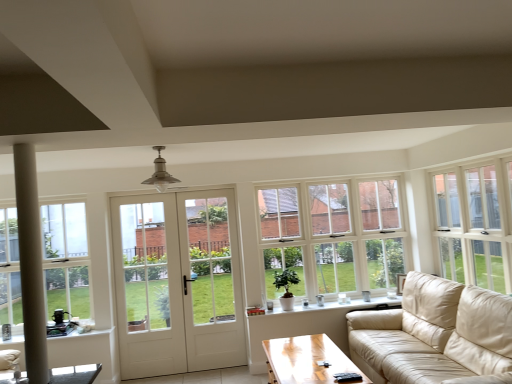
Question: Based on their positions, is clear glass window at left, placed as the third window when sorted from right to left, located to the left or right of white glass window at upper right, the first window when ordered from front to back?

Choices:
 (A) right
 (B) left

Answer: (B)

Question: Considering the positions of point (0, 322) and point (449, 251), is point (0, 322) closer or farther from the camera than point (449, 251)?

Choices:
 (A) farther
 (B) closer

Answer: (B)

Question: Based on their relative distances, which object is nearer to the white ceramic windowsill at lower center?

Choices:
 (A) beige leather couch at right
 (B) light brown wooden coffee table at lower center
 (C) white glass window at center, placed as the second window when sorted from left to right
 (D) white glass window at upper right, which ranks as the third window in left-to-right order
 (E) white glass door at center

Answer: (C)

Question: Which is farther from the light brown wooden coffee table at lower center?

Choices:
 (A) white glass window at upper right, which is the first window from right to left
 (B) beige leather couch at right
 (C) white glass door at center
 (D) white wooden door at center
 (E) clear glass window at left, marked as the first window in a left-to-right arrangement

Answer: (E)